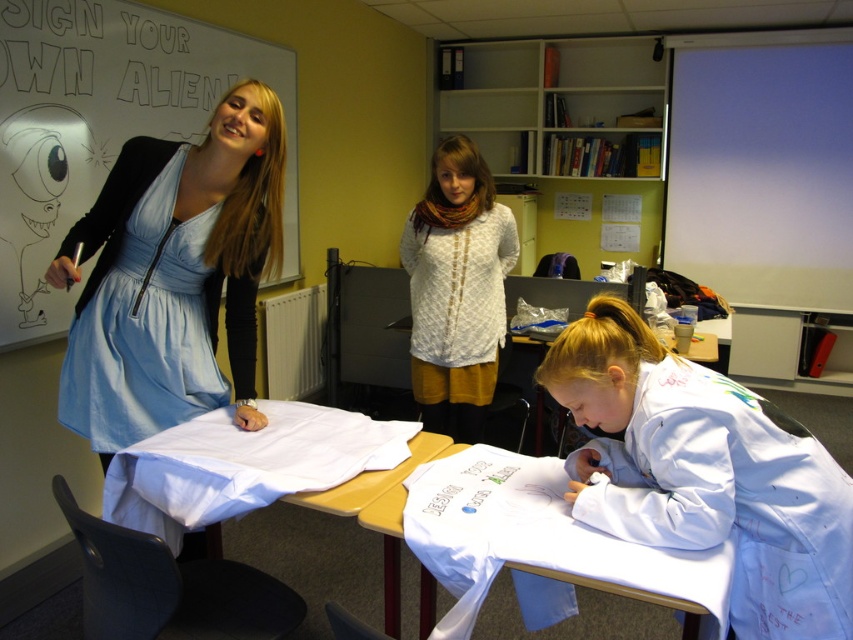
You are standing in the classroom and want to reach a specific point marked at coordinates point [177,42]. If you are currently 10 feet away from the whiteboard, will you need to move closer to reach that point?

The distance of point [177,42] from camera is 9.25 feet, so if you are currently 10 feet away from the whiteboard, you need to move 0.75 feet closer to reach that point.